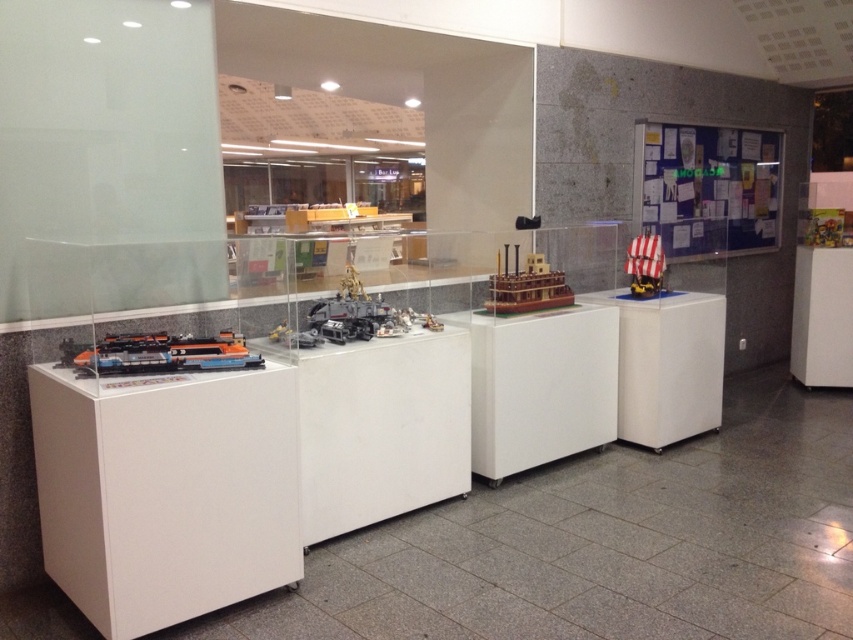
Who is taller, translucent plastic steamboat at center or translucent plastic train at center?

translucent plastic train at center is taller.

The width and height of the screenshot is (853, 640). Describe the element at coordinates (527, 288) in the screenshot. I see `translucent plastic steamboat at center` at that location.

Between point (523, 294) and point (357, 305), which one is positioned in front?

Positioned in front is point (357, 305).

At what (x,y) coordinates should I click in order to perform the action: click on translucent plastic steamboat at center. Please return your answer as a coordinate pair (x, y). This screenshot has width=853, height=640. Looking at the image, I should click on (527, 288).

Between translucent plastic train at center and white striped wood ship at right, which one has more height?

white striped wood ship at right is taller.

Is point (338, 337) more distant than point (640, 268)?

No, (338, 337) is in front of (640, 268).

Who is more forward, (x=370, y=304) or (x=641, y=278)?

Point (x=370, y=304) is more forward.

Where is `translucent plastic train at center`? translucent plastic train at center is located at coordinates (347, 310).

Does white plastic table at right appear on the left side of translucent plastic train at center?

In fact, white plastic table at right is to the right of translucent plastic train at center.

Does point (660, 394) lie behind point (369, 330)?

Yes, point (660, 394) is behind point (369, 330).

Locate an element on the screen. The image size is (853, 640). white plastic table at right is located at coordinates (666, 364).